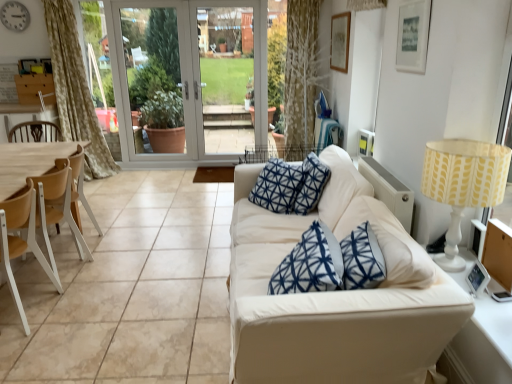
I want to click on free location to the right of wooden at left, the second chair in the back-to-front sequence, so click(x=77, y=313).